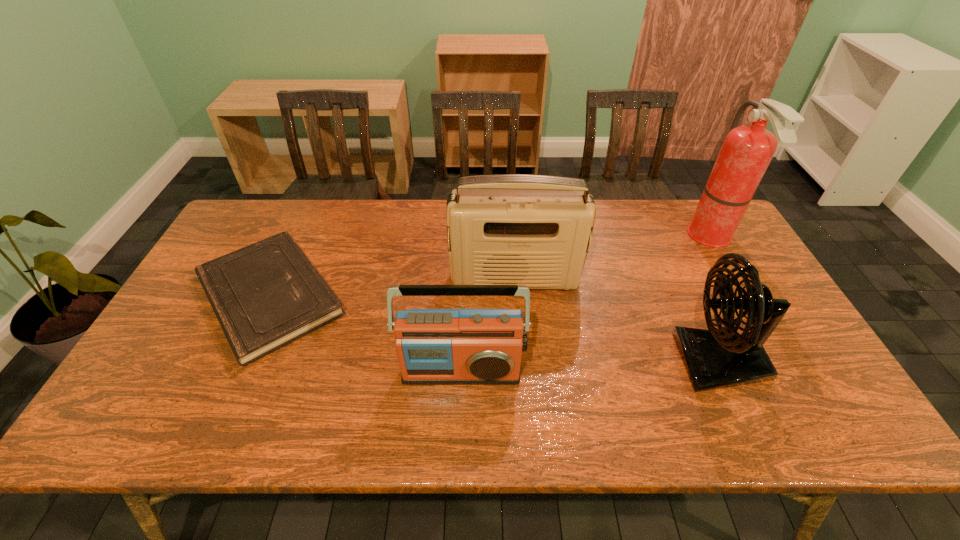
The height and width of the screenshot is (540, 960). What are the coordinates of `vacant point that satisfies the following two spatial constraints: 1. with the handle and hose on the fire extinguisher; 2. on the front-facing side of the shorter radio receiver` in the screenshot? It's located at (787, 370).

In order to click on free space that satisfies the following two spatial constraints: 1. with the handle and hose on the fire extinguisher; 2. on the front-facing side of the second shortest object in this screenshot , I will do `click(787, 370)`.